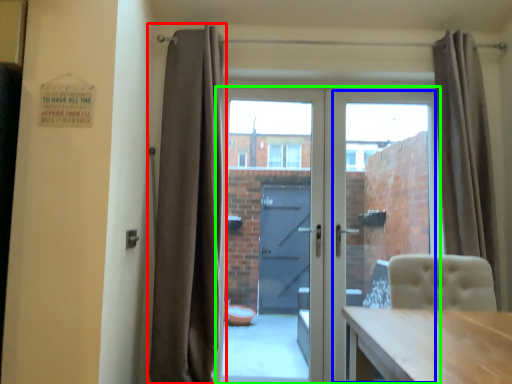
Question: Based on their relative distances, which object is nearer to curtain (highlighted by a red box)? Choose from glass door (highlighted by a blue box) and door (highlighted by a green box).

Choices:
 (A) glass door
 (B) door

Answer: (B)